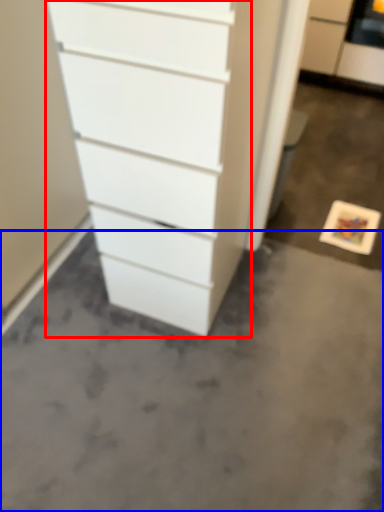
Question: Among these objects, which one is farthest to the camera, chest of drawers (highlighted by a red box) or concrete (highlighted by a blue box)?

Choices:
 (A) chest of drawers
 (B) concrete

Answer: (B)